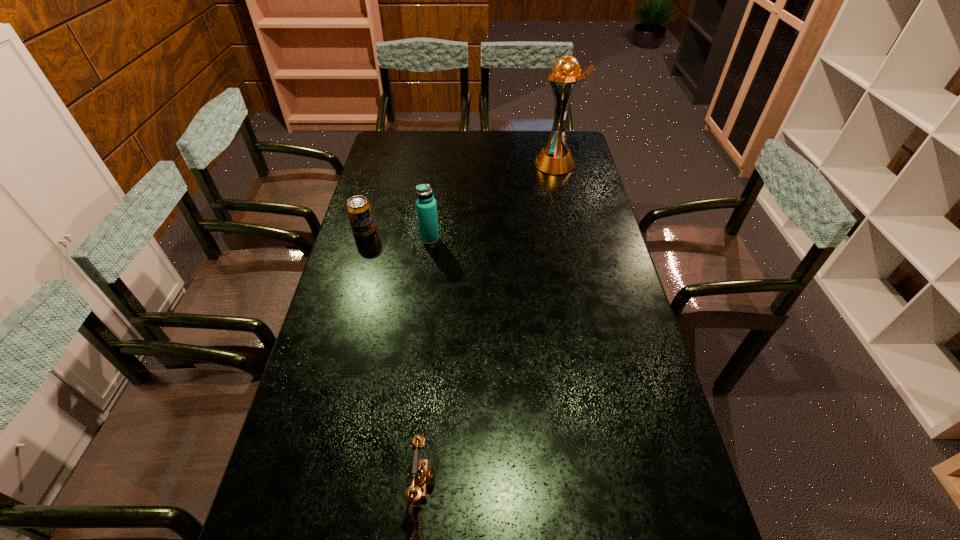
Where is `object that stands as the third closest to the soda can`? The height and width of the screenshot is (540, 960). object that stands as the third closest to the soda can is located at coordinates (422, 476).